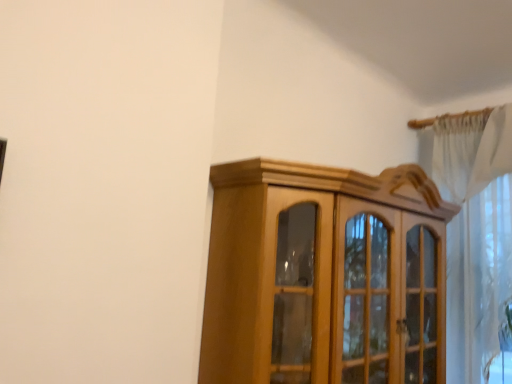
Question: Looking at their shapes, would you say white sheer curtain at upper right is wider or thinner than light brown wood cabinet at center?

Choices:
 (A) wide
 (B) thin

Answer: (B)

Question: From a real-world perspective, is white sheer curtain at upper right above or below light brown wood cabinet at center?

Choices:
 (A) below
 (B) above

Answer: (B)

Question: Based on their positions, is white sheer curtain at upper right located to the left or right of light brown wood cabinet at center?

Choices:
 (A) left
 (B) right

Answer: (B)

Question: From a real-world perspective, is light brown wood cabinet at center above or below white sheer curtain at upper right?

Choices:
 (A) above
 (B) below

Answer: (B)

Question: Is light brown wood cabinet at center inside or outside of white sheer curtain at upper right?

Choices:
 (A) inside
 (B) outside

Answer: (B)

Question: Relative to white sheer curtain at upper right, is light brown wood cabinet at center in front or behind?

Choices:
 (A) front
 (B) behind

Answer: (A)

Question: From the image's perspective, is light brown wood cabinet at center above or below white sheer curtain at upper right?

Choices:
 (A) below
 (B) above

Answer: (A)